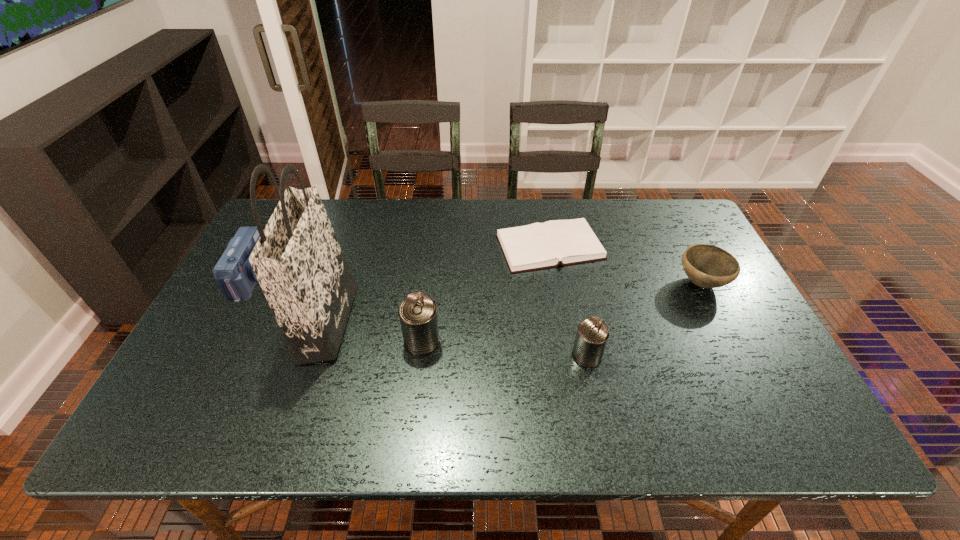
This screenshot has width=960, height=540. In order to click on free space at the near edge of the desktop in this screenshot , I will do `click(621, 389)`.

Image resolution: width=960 pixels, height=540 pixels. In the image, there is a desktop. Find the location of `blank space at the left edge`. blank space at the left edge is located at coordinates (215, 362).

This screenshot has width=960, height=540. I want to click on vacant area at the right edge, so click(x=772, y=362).

This screenshot has width=960, height=540. Identify the location of blank area at the far left corner. (266, 224).

Find the location of a particular element. free space at the far right corner is located at coordinates (651, 224).

Where is `vacant space at the near right corner of the desktop`? The image size is (960, 540). vacant space at the near right corner of the desktop is located at coordinates (773, 375).

You are a GUI agent. You are given a task and a screenshot of the screen. Output one action in this format:
    pyautogui.click(x=<x>, y=<y>)
    Task: Click on the unoccupied position between the hardback book and the rightmost object
    The height and width of the screenshot is (540, 960).
    Given the screenshot: What is the action you would take?
    pyautogui.click(x=626, y=265)

You are a GUI agent. You are given a task and a screenshot of the screen. Output one action in this format:
    pyautogui.click(x=<x>, y=<y>)
    Task: Click on the unoccupied area between the third object from left to right and the tallest object
    Image resolution: width=960 pixels, height=540 pixels.
    Given the screenshot: What is the action you would take?
    pyautogui.click(x=374, y=332)

You are a GUI agent. You are given a task and a screenshot of the screen. Output one action in this format:
    pyautogui.click(x=<x>, y=<y>)
    Task: Click on the empty location between the right can and the shopping bag
    This screenshot has width=960, height=540.
    Given the screenshot: What is the action you would take?
    pyautogui.click(x=457, y=339)

This screenshot has height=540, width=960. Find the location of `vacant area that lies between the rightmost object and the shopping bag`. vacant area that lies between the rightmost object and the shopping bag is located at coordinates (515, 303).